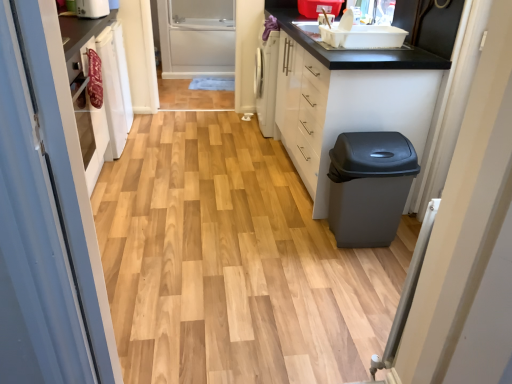
Where is `vacant area that is in front of white glossy cabinet at right`? This screenshot has width=512, height=384. vacant area that is in front of white glossy cabinet at right is located at coordinates (289, 249).